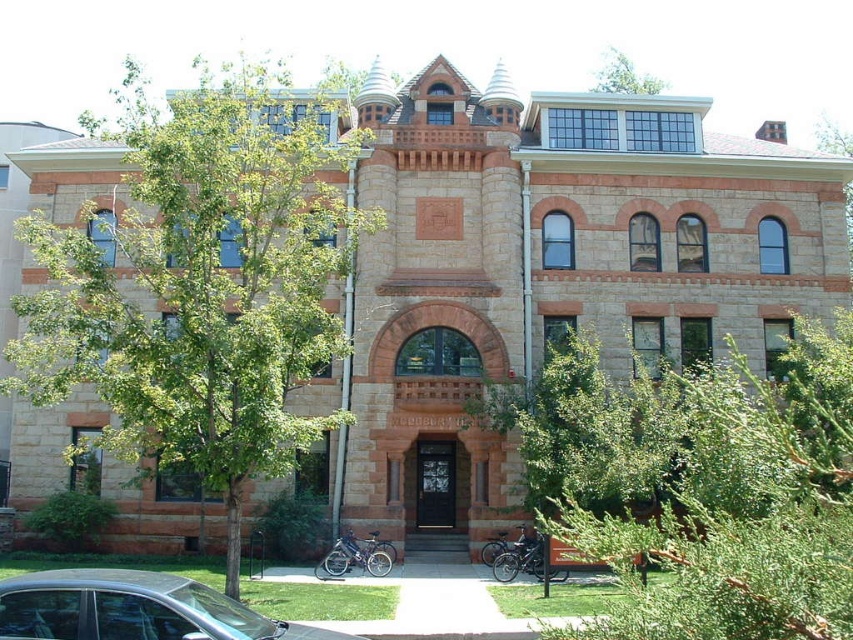
Between green leafy tree at left and silver metallic car at lower left, which one is positioned lower?

silver metallic car at lower left is below.

Is green leafy tree at left to the left of silver metallic car at lower left from the viewer's perspective?

Yes, green leafy tree at left is to the left of silver metallic car at lower left.

Where is `green leafy tree at left`? green leafy tree at left is located at coordinates (201, 284).

Which of these two, green leafy tree at left or green leafy tree at upper center, stands shorter?

green leafy tree at upper center is shorter.

Does point (189, 296) come in front of point (596, 83)?

Yes, point (189, 296) is in front of point (596, 83).

This screenshot has height=640, width=853. In order to click on green leafy tree at left in this screenshot , I will do `click(201, 284)`.

Image resolution: width=853 pixels, height=640 pixels. I want to click on green leafy tree at left, so click(201, 284).

Who is more distant from viewer, (283, 632) or (599, 88)?

Point (599, 88)

Does silver metallic car at lower left come behind green leafy tree at upper center?

No, it is not.

What do you see at coordinates (132, 609) in the screenshot?
I see `silver metallic car at lower left` at bounding box center [132, 609].

Locate an element on the screen. silver metallic car at lower left is located at coordinates (132, 609).